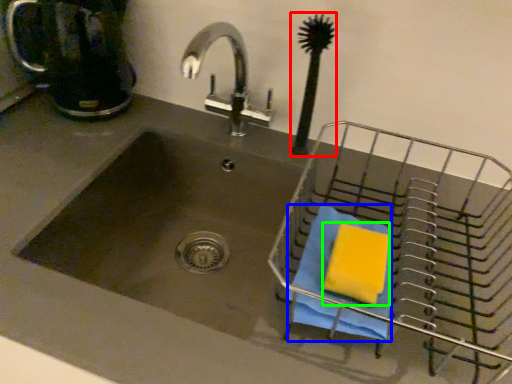
Question: Which is nearer to the brush (highlighted by a red box)? beach towel (highlighted by a blue box) or soap (highlighted by a green box).

Choices:
 (A) beach towel
 (B) soap

Answer: (A)